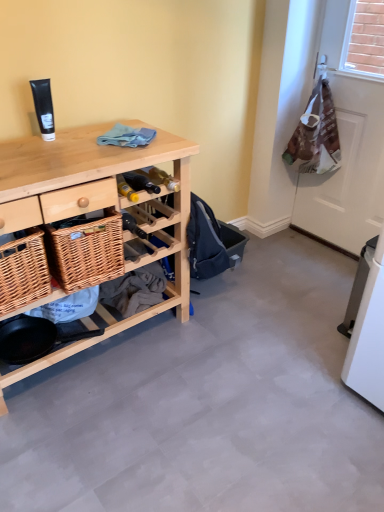
Find the location of `space that is in front of natural wood desk at left`. space that is in front of natural wood desk at left is located at coordinates (113, 437).